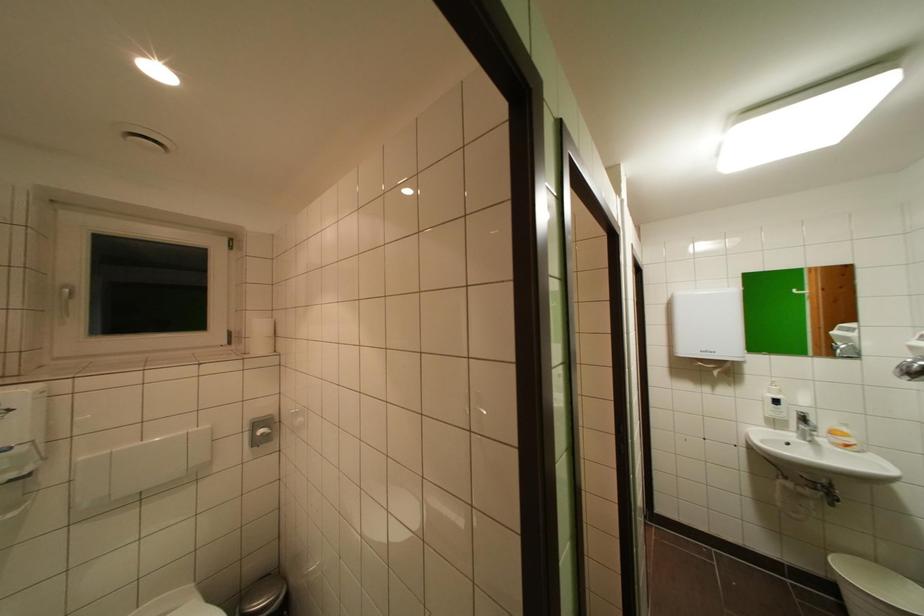
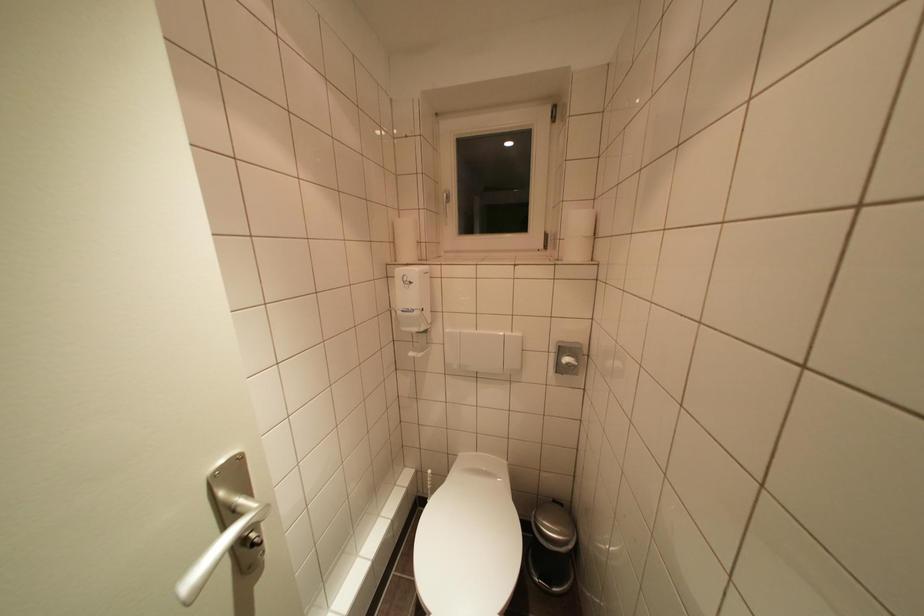
The first image is from the beginning of the video and the second image is from the end. How did the camera likely rotate when shooting the video?

The camera rotated toward left-down.